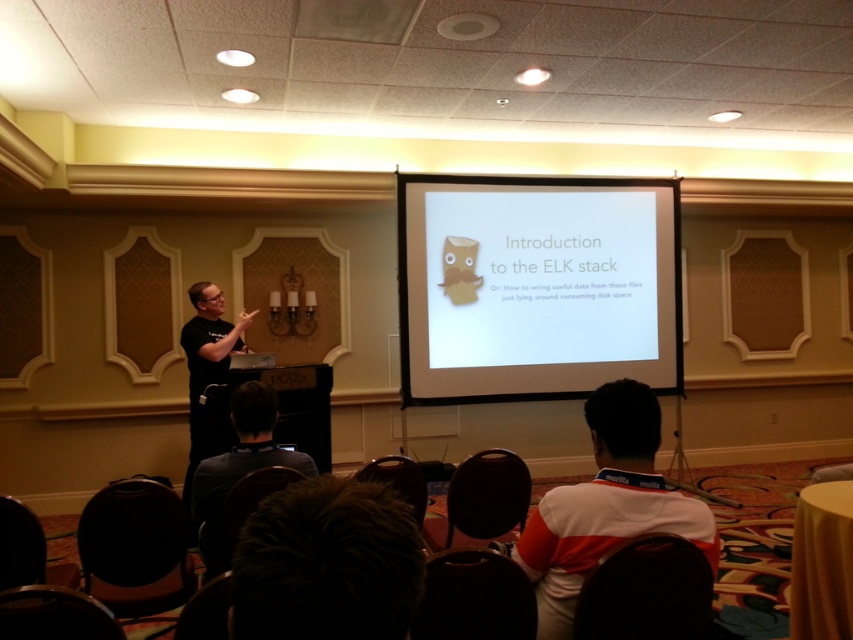
What is located at the point with coordinates (606, 506) in the image?

The point at coordinates (606, 506) corresponds to the white striped shirt at lower center.

You are an attendee at a presentation and you see the white striped shirt at lower center and the black matte shirt at left. Which shirt is more to the right side?

The white striped shirt at lower center is more to the right side.